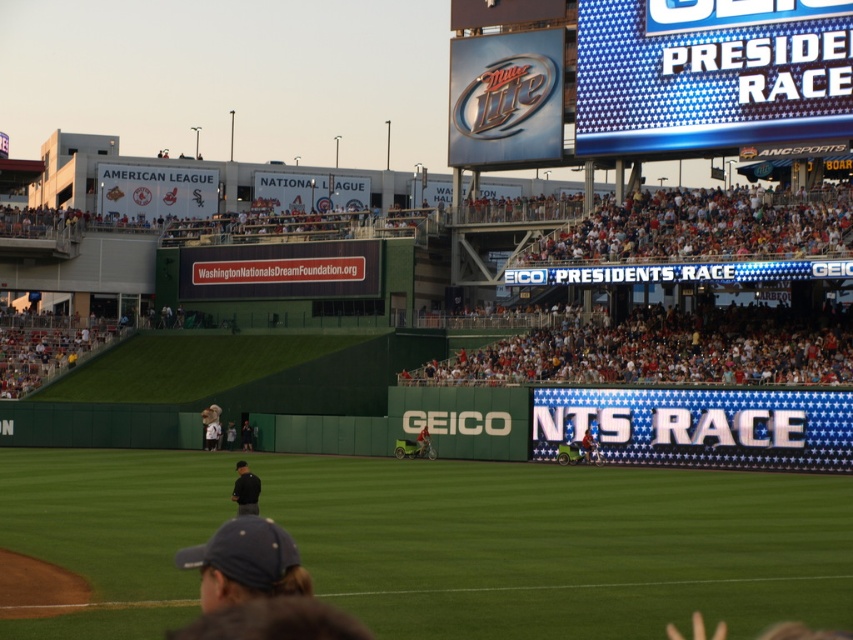
Does black matte baseball cap at lower center have a greater height compared to dark blue uniform at center?

Yes, black matte baseball cap at lower center is taller than dark blue uniform at center.

Who is more forward, [247,461] or [231,445]?

Point [247,461]

Find the location of a particular element. This screenshot has height=640, width=853. black matte baseball cap at lower center is located at coordinates (245, 490).

Is metallic silver bicycle at center taller than dark blue uniform at center?

Yes, metallic silver bicycle at center is taller than dark blue uniform at center.

Measure the distance between metallic silver bicycle at center and dark blue uniform at center.

A distance of 18.19 meters exists between metallic silver bicycle at center and dark blue uniform at center.

The height and width of the screenshot is (640, 853). I want to click on metallic silver bicycle at center, so click(589, 445).

Can you confirm if blue led scoreboard at upper right is bigger than dark blue uniform at center?

Correct, blue led scoreboard at upper right is larger in size than dark blue uniform at center.

Is point (834, 97) farther from viewer compared to point (233, 445)?

No.

What do you see at coordinates (711, 72) in the screenshot?
I see `blue led scoreboard at upper right` at bounding box center [711, 72].

Find the location of a particular element. Image resolution: width=853 pixels, height=640 pixels. blue led scoreboard at upper right is located at coordinates (711, 72).